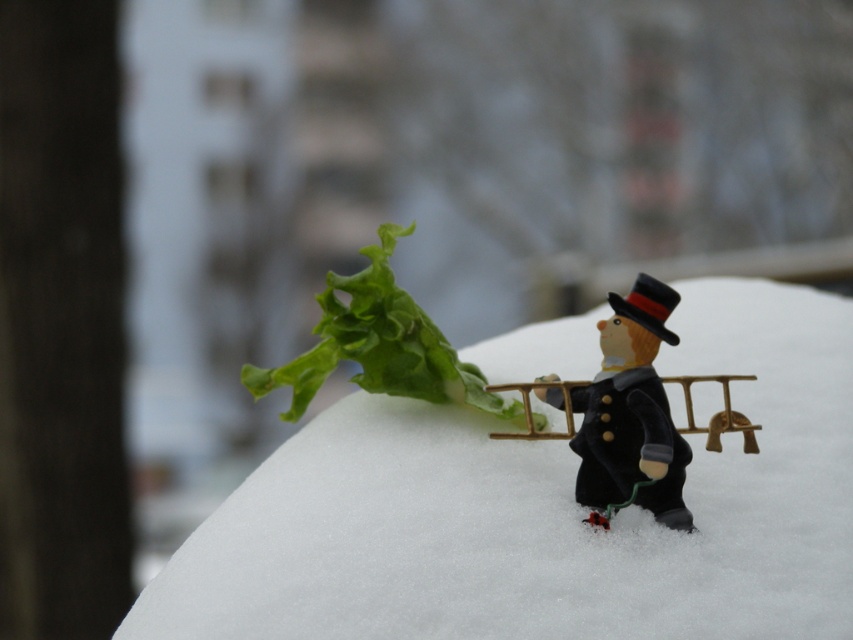
Does white fluffy snow at center appear on the right side of velvet black toy at center?

Indeed, white fluffy snow at center is positioned on the right side of velvet black toy at center.

Is point (360, 624) positioned after point (653, 372)?

No, it is in front of (653, 372).

Between point (453, 621) and point (633, 419), which one is positioned in front?

Point (453, 621) is more forward.

Find the location of a particular element. The width and height of the screenshot is (853, 640). white fluffy snow at center is located at coordinates (544, 512).